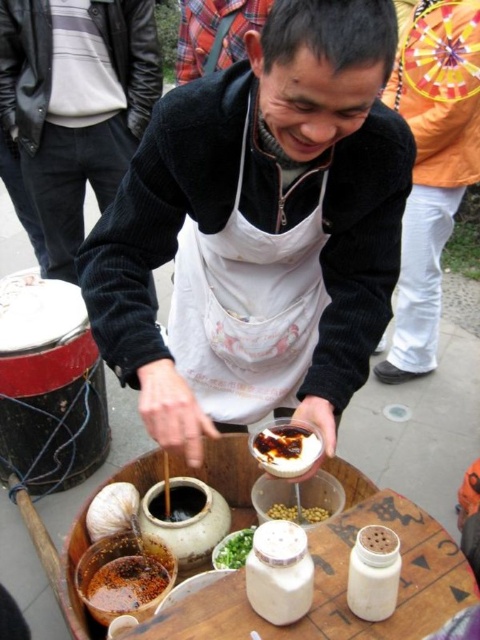
Is point (145, 3) positioned after point (295, 470)?

That is True.

Is matte black apron at center shorter than savory brown sauce at center?

Incorrect, matte black apron at center's height does not fall short of savory brown sauce at center's.

Which is behind, point (2, 42) or point (311, 435)?

The point (2, 42) is behind.

Locate an element on the screen. matte black apron at center is located at coordinates (74, 112).

Between point (314, 401) and point (243, 529), which one is positioned in front?

Point (314, 401)

What do you see at coordinates (264, 202) in the screenshot?
I see `white matte apron at center` at bounding box center [264, 202].

Where is `white matte apron at center`? The width and height of the screenshot is (480, 640). white matte apron at center is located at coordinates (264, 202).

Which of these two, brown matte clay pot at lower left or yellow matte beans at center, stands shorter?

yellow matte beans at center is shorter.

Is point (108, 500) positioned behind point (302, 509)?

Yes.

Is point (113, 497) farther from viewer compared to point (272, 508)?

Yes, it is.

In order to click on brown matte clay pot at lower left in this screenshot , I will do `click(112, 509)`.